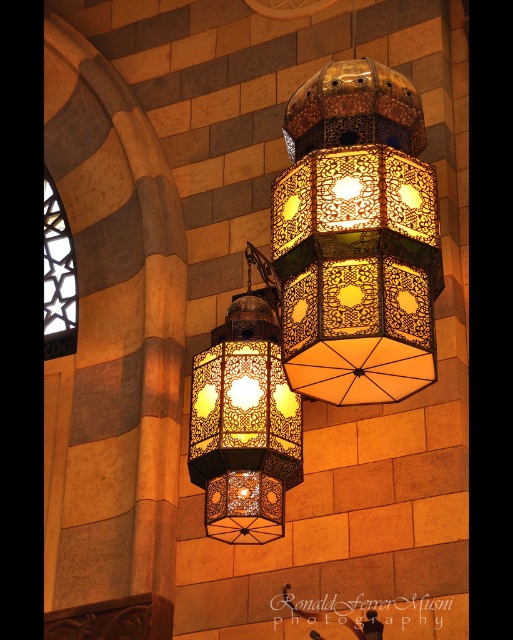
Question: Is golden metallic lantern at center wider than matte metal lantern at center?

Choices:
 (A) no
 (B) yes

Answer: (B)

Question: Which of the following is the closest to the observer?

Choices:
 (A) matte metal lantern at center
 (B) golden metallic lantern at center

Answer: (B)

Question: Is golden metallic lantern at center thinner than matte metal lantern at center?

Choices:
 (A) no
 (B) yes

Answer: (A)

Question: Does golden metallic lantern at center come in front of matte metal lantern at center?

Choices:
 (A) no
 (B) yes

Answer: (B)

Question: Which point is farther to the camera?

Choices:
 (A) (282, 451)
 (B) (412, 97)

Answer: (A)

Question: Which object appears farthest from the camera in this image?

Choices:
 (A) golden metallic lantern at center
 (B) matte metal lantern at center

Answer: (B)